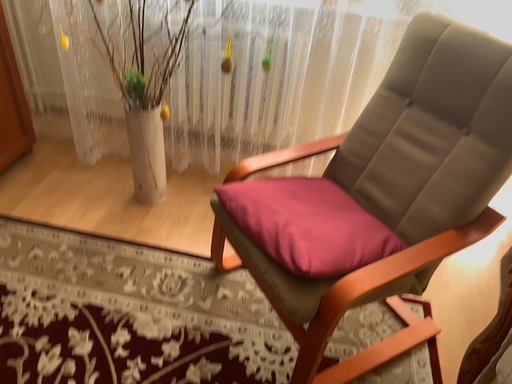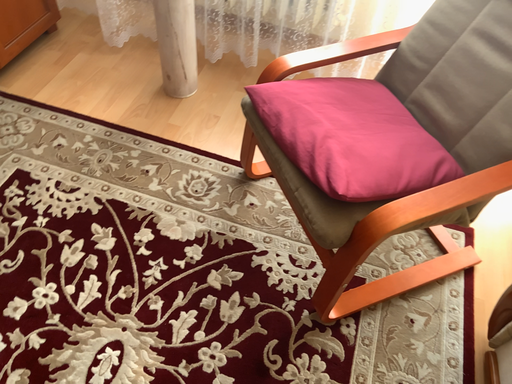
Question: How did the camera likely rotate when shooting the video?

Choices:
 (A) rotated upward
 (B) rotated downward

Answer: (B)